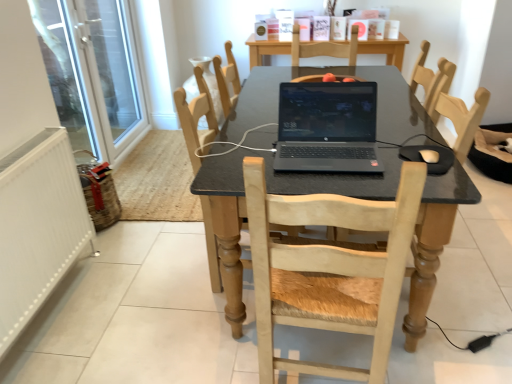
This screenshot has width=512, height=384. I want to click on empty space that is in between light wood chair at center, the 3th chair positioned from the back, and white textured radiator at left, so click(x=147, y=327).